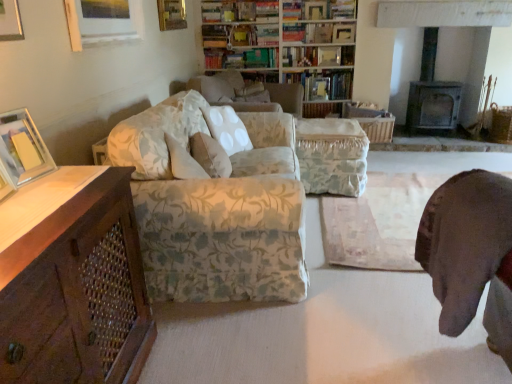
Find the location of a particular element. vacant area that is in front of matte glass picture frame at upper left, the second picture frame in the left-to-right sequence is located at coordinates (28, 196).